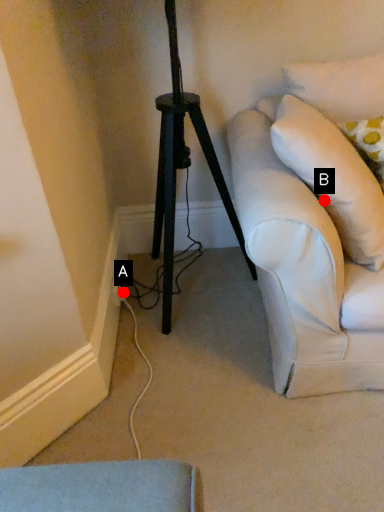
Question: Two points are circled on the image, labeled by A and B beside each circle. Which point is further to the camera?

Choices:
 (A) A is further
 (B) B is further

Answer: (A)